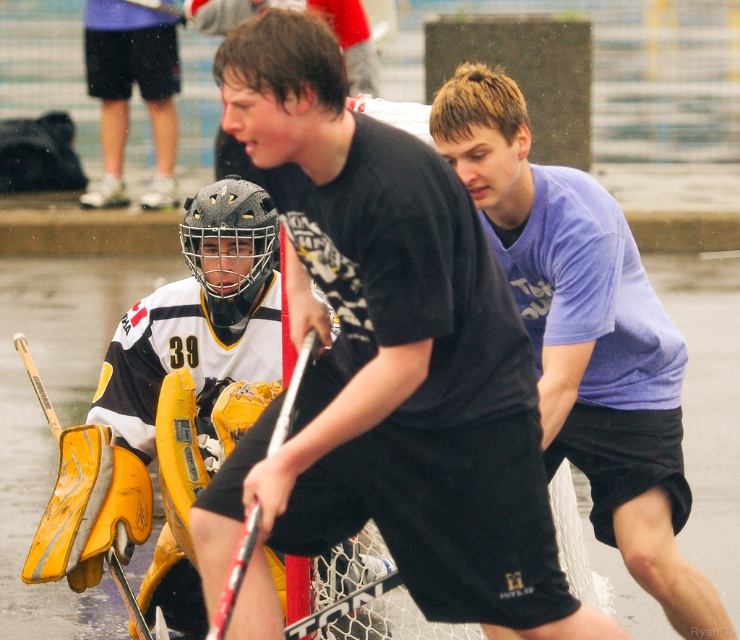
Can you confirm if purple cotton shirt at center is thinner than yellow matte goalie pads at lower left?

No, purple cotton shirt at center is not thinner than yellow matte goalie pads at lower left.

Is purple cotton shirt at center to the left of yellow matte goalie pads at lower left from the viewer's perspective?

No, purple cotton shirt at center is not to the left of yellow matte goalie pads at lower left.

At what (x,y) coordinates should I click in order to perform the action: click on purple cotton shirt at center. Please return your answer as a coordinate pair (x, y). The height and width of the screenshot is (640, 740). Looking at the image, I should click on (585, 337).

Locate an element on the screen. purple cotton shirt at center is located at coordinates (585, 337).

Does black matte shirt at center appear on the right side of yellow matte goalie pads at lower left?

Yes, black matte shirt at center is to the right of yellow matte goalie pads at lower left.

Between black matte shirt at center and yellow matte goalie pads at lower left, which one has less height?

With less height is black matte shirt at center.

Locate an element on the screen. black matte shirt at center is located at coordinates (383, 364).

Can you confirm if black matte shirt at center is positioned above purple cotton shirt at center?

Yes.

Which is behind, point (354, 481) or point (659, 339)?

Point (659, 339)

What do you see at coordinates (383, 364) in the screenshot? I see `black matte shirt at center` at bounding box center [383, 364].

Identify the location of black matte shirt at center. (383, 364).